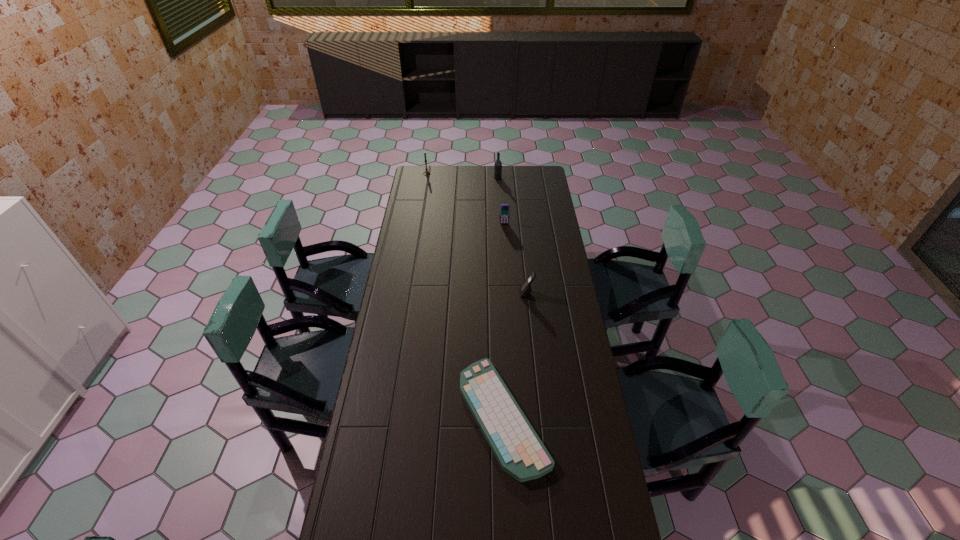
Identify the location of vodka. The image size is (960, 540). (498, 164).

The width and height of the screenshot is (960, 540). In order to click on the farthest object in this screenshot , I will do `click(426, 172)`.

Identify the location of candle. The width and height of the screenshot is (960, 540). (426, 172).

Identify the location of the farther cellular telephone. This screenshot has height=540, width=960. (504, 208).

The width and height of the screenshot is (960, 540). Find the location of `the third nearest object`. the third nearest object is located at coordinates pos(504,208).

The height and width of the screenshot is (540, 960). I want to click on the nearer cellular telephone, so click(x=525, y=289).

Find the location of a particular element. the second nearest object is located at coordinates (525, 289).

Locate an element on the screen. The height and width of the screenshot is (540, 960). the shortest object is located at coordinates (517, 447).

At what (x,y) coordinates should I click in order to perform the action: click on the nearest object. Please return your answer as a coordinate pair (x, y). The height and width of the screenshot is (540, 960). Looking at the image, I should click on (517, 447).

Locate an element on the screen. vacant space situated 0.380m on the left of the fourth nearest object is located at coordinates (432, 178).